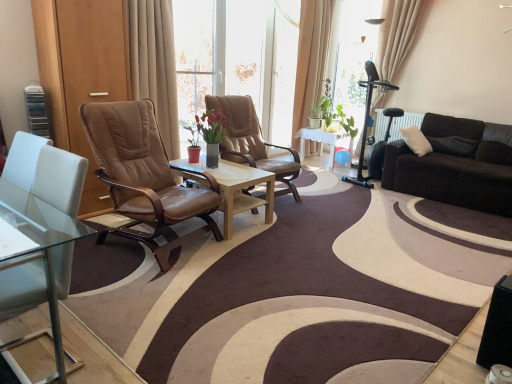
Question: Considering the positions of point (510, 135) and point (227, 135), is point (510, 135) closer or farther from the camera than point (227, 135)?

Choices:
 (A) closer
 (B) farther

Answer: (B)

Question: Considering their positions, is black leather couch at right located in front of or behind leather at center, the second chair in the front-to-back sequence?

Choices:
 (A) front
 (B) behind

Answer: (B)

Question: Which object is the farthest from the beige fabric curtain at upper right, which is the 2th curtain in back-to-front order?

Choices:
 (A) brown leather chair at center, the 2th chair when ordered from back to front
 (B) green glossy plant at center
 (C) white glossy table at center
 (D) leather at center, the second chair in the front-to-back sequence
 (E) beige fabric curtain at upper center, acting as the 3th curtain starting from the right

Answer: (A)

Question: Estimate the real-world distances between objects in this image. Which object is closer to the beige fabric curtain at upper center, the 2th curtain viewed from the left?

Choices:
 (A) white glossy table at center
 (B) beige fabric curtain at upper center, acting as the 3th curtain starting from the right
 (C) transparent glass window screen at upper center
 (D) beige fabric curtain at upper right, which is the 2th curtain in back-to-front order
 (E) leather at center, which ranks as the first chair in back-to-front order

Answer: (C)